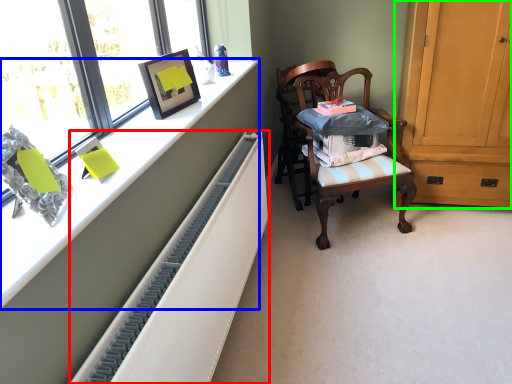
Question: Considering the real-world distances, which object is farthest from radiator (highlighted by a red box)? desk (highlighted by a blue box) or cabinetry (highlighted by a green box)?

Choices:
 (A) desk
 (B) cabinetry

Answer: (B)